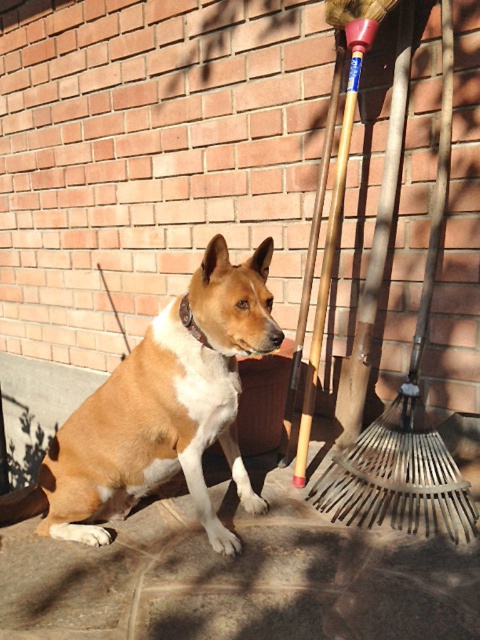
Can you confirm if brown stone pavement at lower center is shorter than wooden shovel at right?

Indeed, brown stone pavement at lower center has a lesser height compared to wooden shovel at right.

Locate an element on the screen. Image resolution: width=480 pixels, height=640 pixels. brown stone pavement at lower center is located at coordinates (239, 577).

Locate an element on the screen. The height and width of the screenshot is (640, 480). brown stone pavement at lower center is located at coordinates (239, 577).

Can you confirm if brown stone pavement at lower center is shorter than brown fur dog at center?

Indeed, brown stone pavement at lower center has a lesser height compared to brown fur dog at center.

Is point (412, 618) less distant than point (203, 330)?

Yes, point (412, 618) is closer to viewer.

You are a GUI agent. You are given a task and a screenshot of the screen. Output one action in this format:
    pyautogui.click(x=<x>, y=<y>)
    Task: Click on the brown stone pavement at lower center
    
    Given the screenshot: What is the action you would take?
    pyautogui.click(x=239, y=577)

How far apart are brown fur dog at center and wooden shovel at right?

The distance of brown fur dog at center from wooden shovel at right is 22.67 inches.

Does brown fur dog at center have a greater height compared to wooden shovel at right?

Incorrect, brown fur dog at center's height is not larger of wooden shovel at right's.

You are a GUI agent. You are given a task and a screenshot of the screen. Output one action in this format:
    pyautogui.click(x=<x>, y=<y>)
    Task: Click on the brown fur dog at center
    
    Given the screenshot: What is the action you would take?
    pyautogui.click(x=160, y=410)